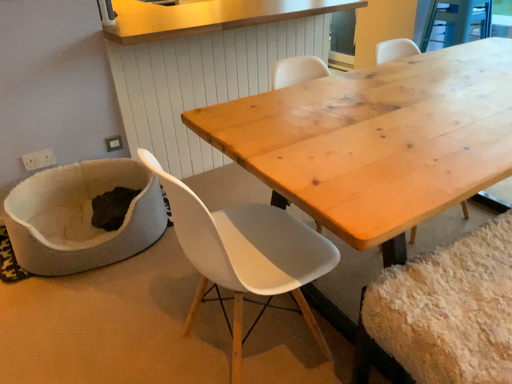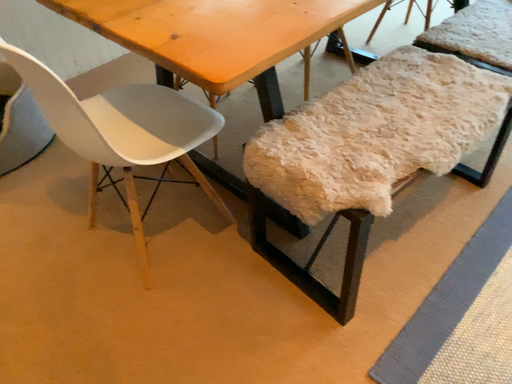
Question: Which way did the camera rotate in the video?

Choices:
 (A) rotated left
 (B) rotated right

Answer: (B)